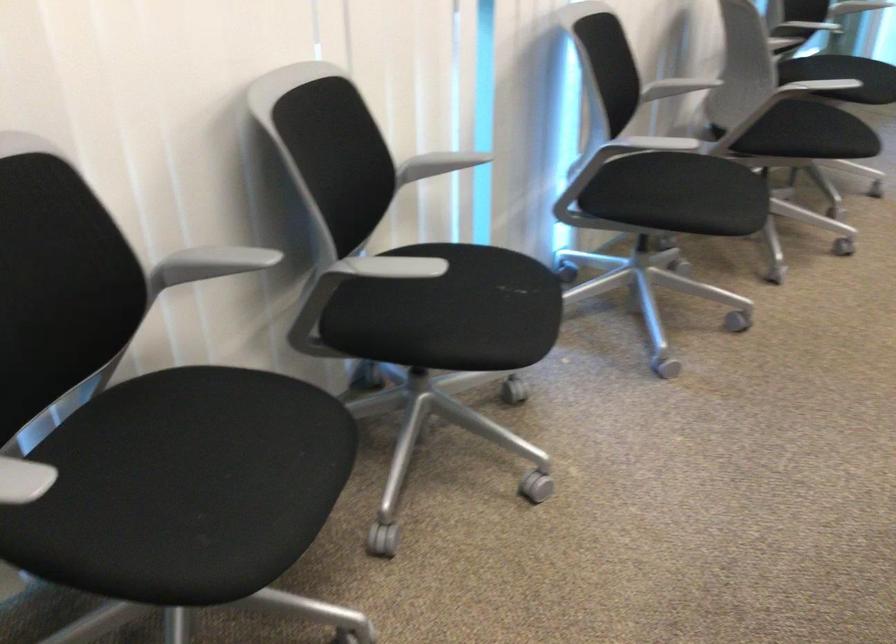
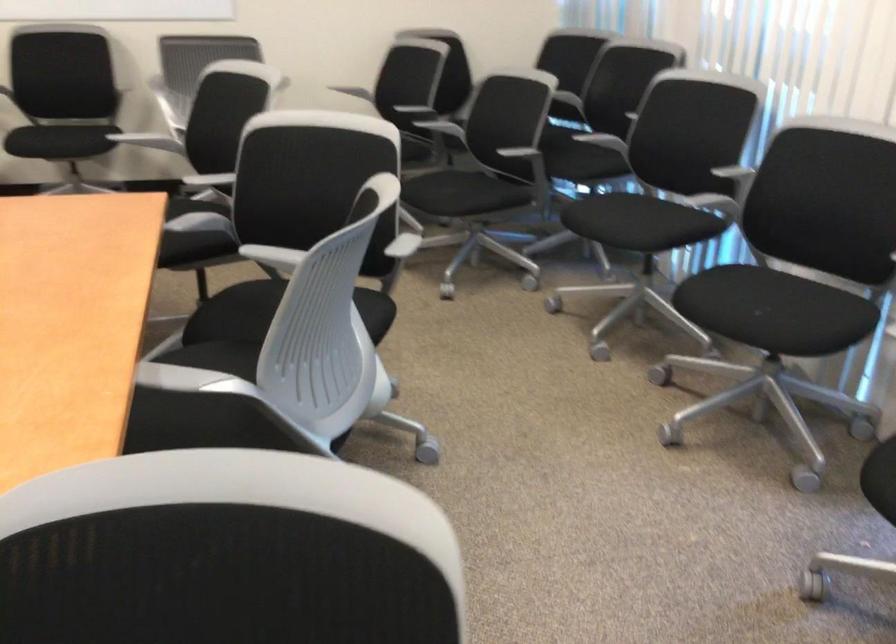
Where in the second image is the point corresponding to point (152, 326) from the first image?

(726, 193)